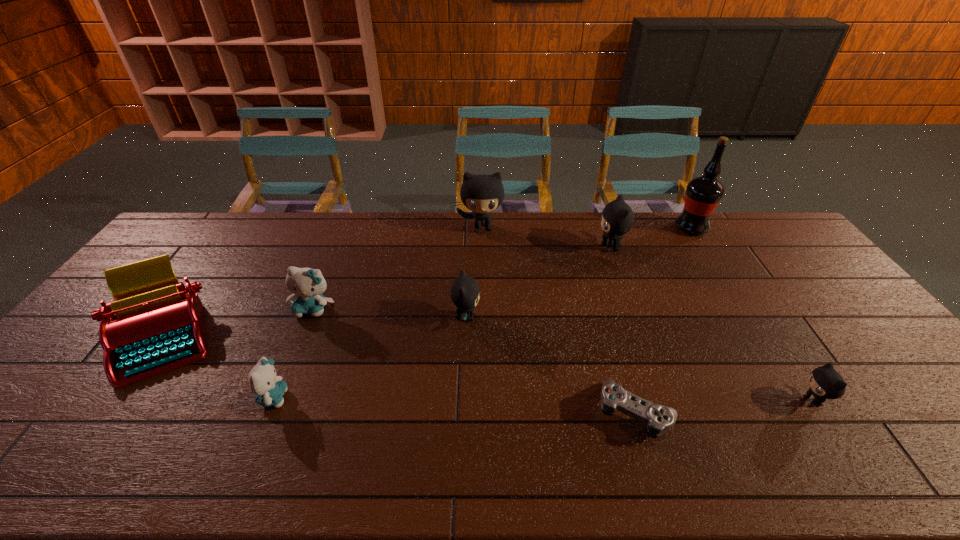
Identify which gray kitten is located as the second nearest to the shortest object. Please provide its 2D coordinates. Your answer should be formatted as a tuple, i.e. [(x, y)], where the tuple contains the x and y coordinates of a point satisfying the conditions above.

[(464, 292)]

Image resolution: width=960 pixels, height=540 pixels. In order to click on vacant point that satisfies the following two spatial constraints: 1. on the typing side of the shortest object; 2. on the right side of the leftmost object in this screenshot , I will do `click(109, 413)`.

The width and height of the screenshot is (960, 540). I want to click on free spot that satisfies the following two spatial constraints: 1. on the front-facing side of the shortest object; 2. on the left side of the biggest gray kitten, so click(484, 413).

At what (x,y) coordinates should I click in order to perform the action: click on vacant space that satisfies the following two spatial constraints: 1. on the front-facing side of the third smallest gray kitten; 2. on the typing side of the typewriter. Please return your answer as a coordinate pair (x, y). This screenshot has height=540, width=960. Looking at the image, I should click on (643, 336).

You are a GUI agent. You are given a task and a screenshot of the screen. Output one action in this format:
    pyautogui.click(x=<x>, y=<y>)
    Task: Click on the vacant space that satisfies the following two spatial constraints: 1. on the face of the smaller blue kitten; 2. on the back side of the shortest object
    This screenshot has height=540, width=960.
    Given the screenshot: What is the action you would take?
    pyautogui.click(x=267, y=413)

Where is `free space in the image that satisfies the following two spatial constraints: 1. on the front-facing side of the third gray kitten from left to right; 2. on the typing side of the typewriter`? free space in the image that satisfies the following two spatial constraints: 1. on the front-facing side of the third gray kitten from left to right; 2. on the typing side of the typewriter is located at coordinates (643, 336).

Identify the location of vacant space that satisfies the following two spatial constraints: 1. on the face of the smaller blue kitten; 2. on the right side of the white control. (267, 413).